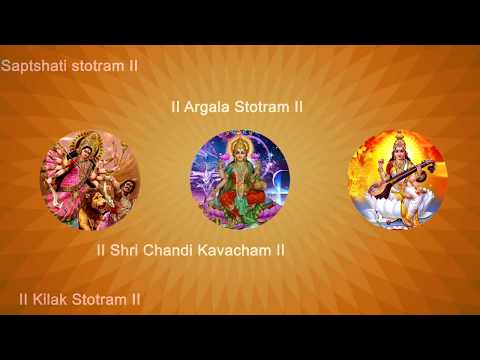
At what (x,y) coordinates should I click in order to perform the action: click on yellow light. Please return your answer as a coordinate pair (x, y). The image size is (480, 360). Looking at the image, I should click on (387, 148).